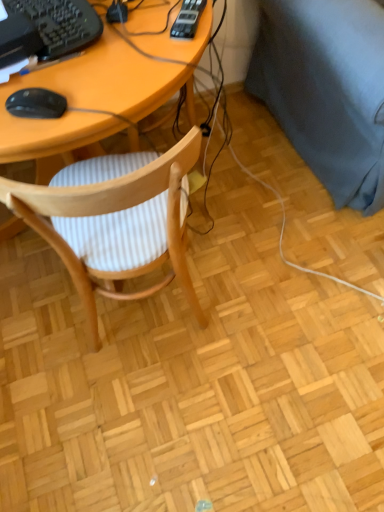
Identify the location of spots to the right of wooden chair with striped cushion at center. Image resolution: width=384 pixels, height=512 pixels. (258, 292).